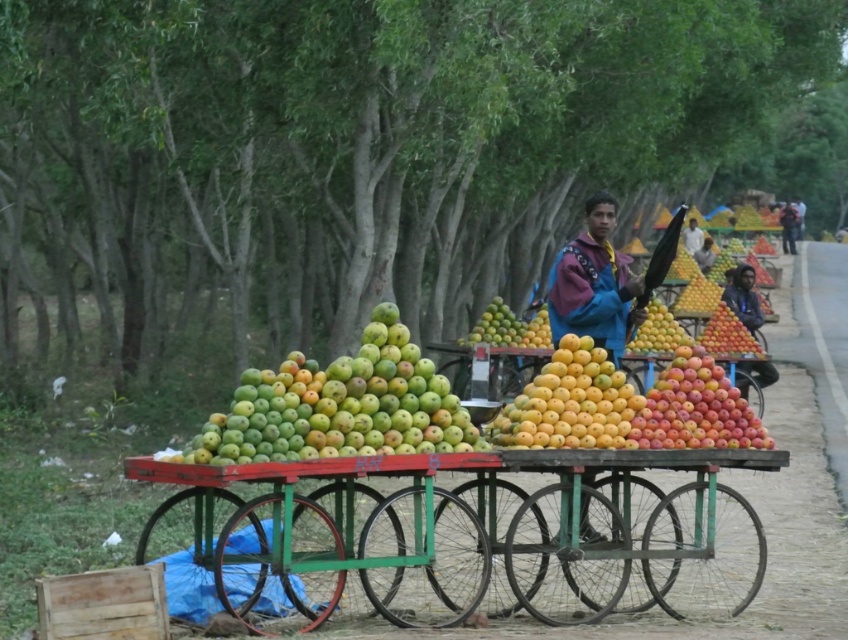
You are a delivery person standing at the roadside near the fruit stall. You need to pick up the blue fleece jacket at center and place it on the cart. The cart is 5 feet away from your current position. Can you reach the jacket without moving closer to the yellow matte mangoes at center?

The distance between the yellow matte mangoes at center and the blue fleece jacket at center is 5.33 feet. Since the cart is only 5 feet away from you, you can reach the jacket without moving closer to the yellow matte mangoes at center because the jacket is slightly farther than the cart.

Based on the photo, you are a customer at the fruit stall and want to buy both the green matte apples at center and the yellow matte mangoes at center. If you first pick up the fruit that is on the left, which one will you pick first?

The green matte apples at center is positioned on the left side of yellow matte mangoes at center, so you will pick the green matte apples at center first.